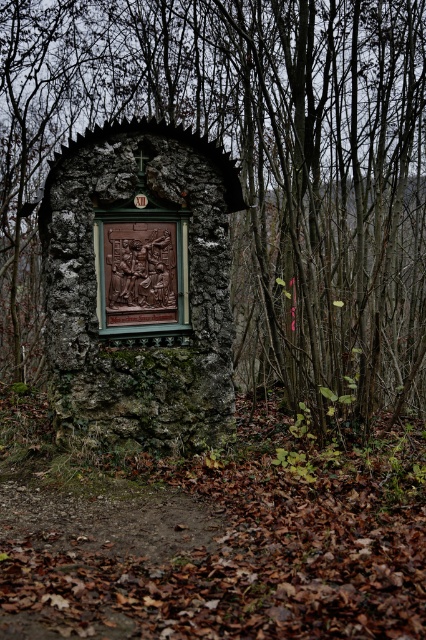
You are standing in front of the stone structure and notice two brown carvings. The first is labeled as the brown stone carving at center, and the second is the brown carved stone at center. According to their positions, which one is located to the left?

The brown stone carving at center is positioned to the left of the brown carved stone at center.

You are standing in a wooded area near a stone monument. You want to take a photo of the brown stone carving at center from a distance that allows it to fit entirely within the frame of your camera, which has a maximum focal length of 50mm. Given that the recommended shooting distance for this focal length to capture the entire monument is 10 meters, will you need to move closer or farther away?

The brown stone carving at center is 9.89 meters away from the viewer. Since the recommended distance is 10 meters, you need to move slightly farther away to ensure the entire monument fits within the camera frame.